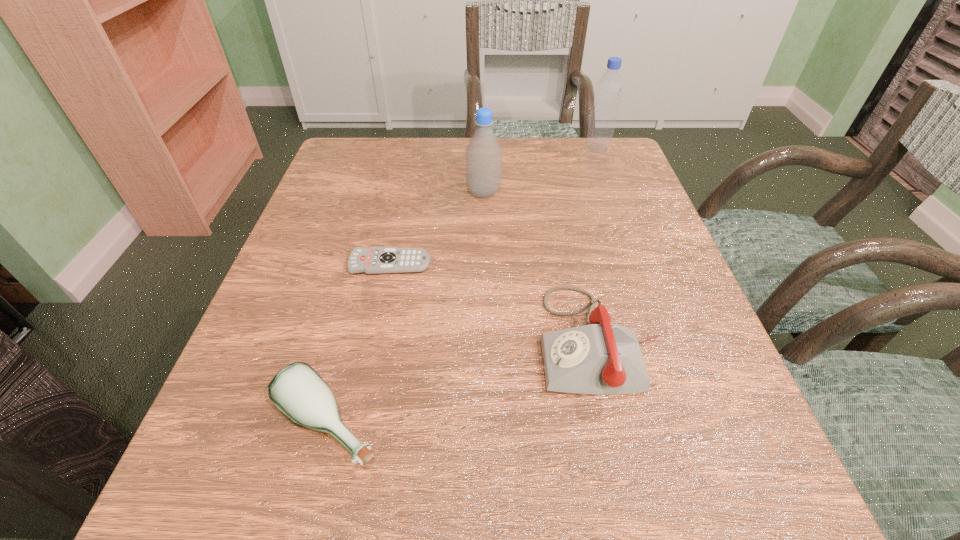
The height and width of the screenshot is (540, 960). I want to click on free space between the farthest bottle and the shortest object, so click(x=493, y=206).

You are a GUI agent. You are given a task and a screenshot of the screen. Output one action in this format:
    pyautogui.click(x=<x>, y=<y>)
    Task: Click on the free space between the farthest object and the leftmost bottle
    The width and height of the screenshot is (960, 540).
    Given the screenshot: What is the action you would take?
    pyautogui.click(x=463, y=286)

Where is `vacant space that is in between the farthest object and the shortest object`? The width and height of the screenshot is (960, 540). vacant space that is in between the farthest object and the shortest object is located at coordinates (493, 206).

This screenshot has width=960, height=540. Find the location of `vacant point located between the shortest object and the rightmost bottle`. vacant point located between the shortest object and the rightmost bottle is located at coordinates (493, 206).

This screenshot has height=540, width=960. Identify the location of vacant area that lies between the leftmost bottle and the farthest bottle. (463, 286).

The height and width of the screenshot is (540, 960). Find the location of `empty space between the nearest bottle and the shortest object`. empty space between the nearest bottle and the shortest object is located at coordinates (359, 344).

At what (x,y) coordinates should I click in order to perform the action: click on free area in between the nearest bottle and the third object from left to right. Please return your answer as a coordinate pair (x, y). The width and height of the screenshot is (960, 540). Looking at the image, I should click on (405, 308).

The width and height of the screenshot is (960, 540). What are the coordinates of `free spot between the telephone and the shortest bottle` in the screenshot? It's located at (464, 382).

Where is `vacant point located between the telephone and the shortest bottle`? vacant point located between the telephone and the shortest bottle is located at coordinates (464, 382).

In order to click on object identified as the third closest to the remote control in this screenshot , I will do `click(297, 390)`.